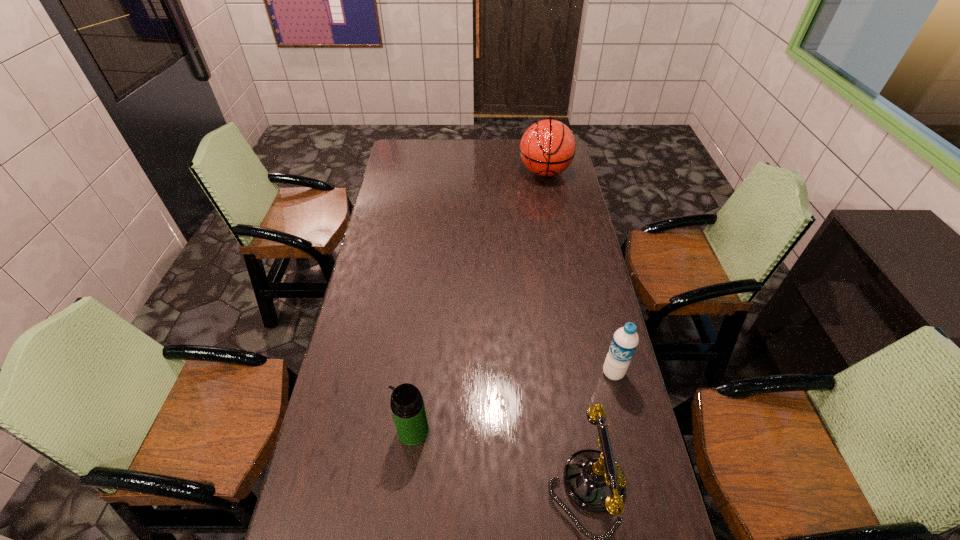
This screenshot has width=960, height=540. What are the coordinates of `the leftmost object` in the screenshot? It's located at (407, 405).

Find the location of a particular element. the farthest object is located at coordinates (547, 148).

You are a GUI agent. You are given a task and a screenshot of the screen. Output one action in this format:
    pyautogui.click(x=<x>, y=<y>)
    Task: Click on the water bottle
    
    Given the screenshot: What is the action you would take?
    pyautogui.click(x=625, y=340)

At what (x,y) coordinates should I click in order to perform the action: click on free space located from the spout of the thermos bottle. Please return your answer as a coordinate pair (x, y). Looking at the image, I should click on (345, 431).

Locate an element on the screen. This screenshot has height=540, width=960. vacant space situated 0.200m from the spout of the thermos bottle is located at coordinates (326, 431).

Where is `vacant space located on the side with spill of the farthest object`? Image resolution: width=960 pixels, height=540 pixels. vacant space located on the side with spill of the farthest object is located at coordinates (534, 223).

Where is `free region located on the side with spill of the farthest object`? free region located on the side with spill of the farthest object is located at coordinates (540, 196).

Locate an element on the screen. free spot located 0.070m on the side with spill of the farthest object is located at coordinates (540, 196).

You are a GUI agent. You are given a task and a screenshot of the screen. Output one action in this format:
    pyautogui.click(x=<x>, y=<y>)
    Task: Click on the free region located 0.160m on the label of the second farthest object
    
    Given the screenshot: What is the action you would take?
    pyautogui.click(x=563, y=402)

Where is `free space located 0.230m on the label of the second farthest object`? This screenshot has height=540, width=960. free space located 0.230m on the label of the second farthest object is located at coordinates (543, 414).